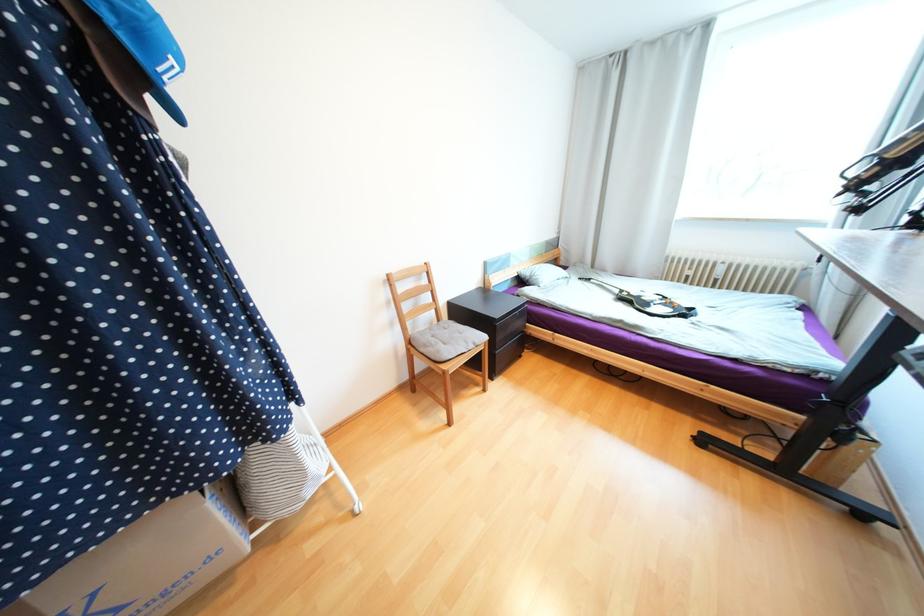
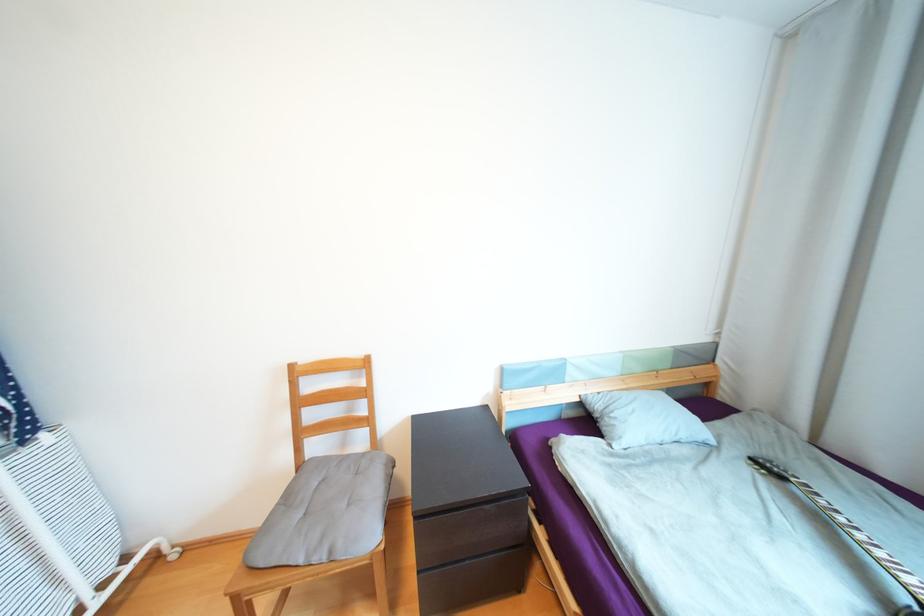
Where in the second image is the point corresponding to point 524,270 from the first image?

(588, 392)